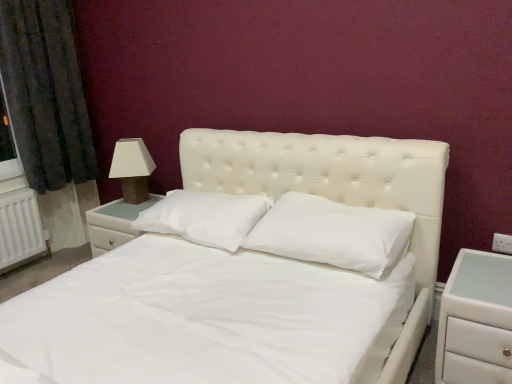
Question: Can you confirm if white soft pillow at center, acting as the 1th pillow starting from the left, is positioned to the left of matte white lampshade at left?

Choices:
 (A) yes
 (B) no

Answer: (B)

Question: From a real-world perspective, is white soft pillow at center, the second pillow positioned from the right, located beneath matte white lampshade at left?

Choices:
 (A) no
 (B) yes

Answer: (B)

Question: Is white soft pillow at center, the second pillow positioned from the right, far away from matte white lampshade at left?

Choices:
 (A) no
 (B) yes

Answer: (A)

Question: Is the position of white soft pillow at center, the second pillow positioned from the right, more distant than that of matte white lampshade at left?

Choices:
 (A) no
 (B) yes

Answer: (A)

Question: Considering the relative sizes of white soft pillow at center, the second pillow positioned from the right, and matte white lampshade at left in the image provided, is white soft pillow at center, the second pillow positioned from the right, thinner than matte white lampshade at left?

Choices:
 (A) no
 (B) yes

Answer: (A)

Question: From a real-world perspective, is white soft pillow at center, acting as the 1th pillow starting from the left, physically located above or below white matte nightstand at right, the first nightstand in the front-to-back sequence?

Choices:
 (A) above
 (B) below

Answer: (A)

Question: Is white soft pillow at center, the second pillow positioned from the right, in front of or behind white matte nightstand at right, the first nightstand in the front-to-back sequence, in the image?

Choices:
 (A) behind
 (B) front

Answer: (A)

Question: Is point [x=257, y=203] positioned closer to the camera than point [x=462, y=362]?

Choices:
 (A) closer
 (B) farther

Answer: (B)

Question: Based on their sizes in the image, would you say white soft pillow at center, the second pillow positioned from the right, is bigger or smaller than white matte nightstand at right, arranged as the second nightstand when viewed from the back?

Choices:
 (A) big
 (B) small

Answer: (B)

Question: Considering the positions of matte white lampshade at left and white soft pillow at center, acting as the 1th pillow starting from the left, in the image, is matte white lampshade at left bigger or smaller than white soft pillow at center, acting as the 1th pillow starting from the left,?

Choices:
 (A) big
 (B) small

Answer: (B)

Question: Is matte white lampshade at left spatially inside white soft pillow at center, acting as the 1th pillow starting from the left, or outside of it?

Choices:
 (A) inside
 (B) outside

Answer: (B)

Question: From the image's perspective, is matte white lampshade at left positioned above or below white soft pillow at center, the second pillow positioned from the right?

Choices:
 (A) below
 (B) above

Answer: (B)

Question: In the image, is matte white lampshade at left positioned in front of or behind white soft pillow at center, the second pillow positioned from the right?

Choices:
 (A) front
 (B) behind

Answer: (B)

Question: Is white matte nightstand at right, arranged as the second nightstand when viewed from the back, inside the boundaries of white glossy nightstand at left, which appears as the second nightstand when viewed from the front, or outside?

Choices:
 (A) inside
 (B) outside

Answer: (B)

Question: Looking at the image, does white matte nightstand at right, arranged as the second nightstand when viewed from the back, seem bigger or smaller compared to white glossy nightstand at left, which appears as the second nightstand when viewed from the front?

Choices:
 (A) small
 (B) big

Answer: (A)